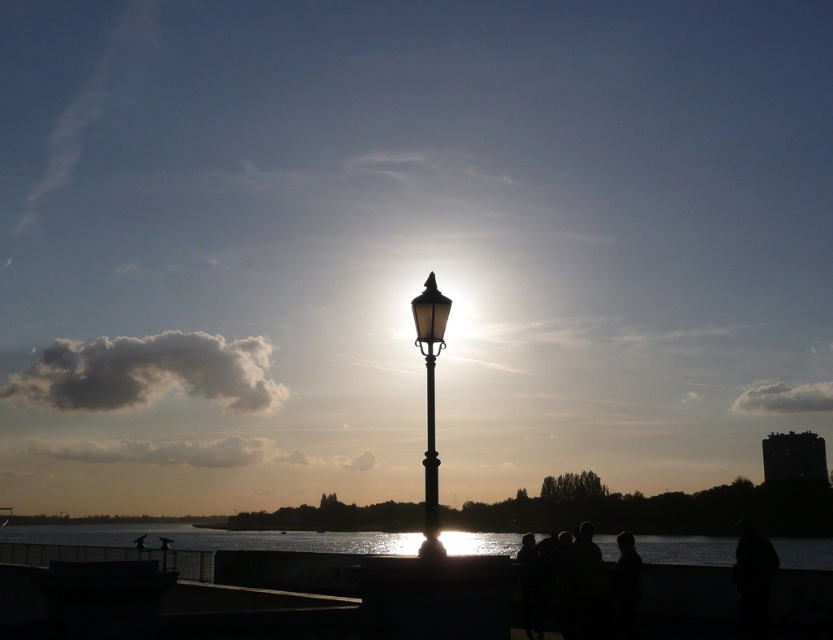
You are a photographer aiming to capture the black polished metal streetlight at center and the metallic pole at center in your shot. Since both are in the same area, which one would appear closer to you in the photo?

The black polished metal streetlight at center would appear closer because it is positioned in front of the metallic pole at center.

Looking at this image, you are standing in the scene and want to move from point (457, 536) to point (432, 312). Which direction should you move relative to your current position?

Since point (457, 536) is further to the camera than point (432, 312), you should move towards the direction away from the camera to reach point (432, 312).

Consider the image. You are a city planner assessing the placement of the black polished metal streetlight at center and the metallic pole at center. Based on their sizes, which one might require more space around it to avoid blocking the view of the other?

The black polished metal streetlight at center is bigger than the metallic pole at center, so it would require more space around it to avoid blocking the view of the metallic pole at center.